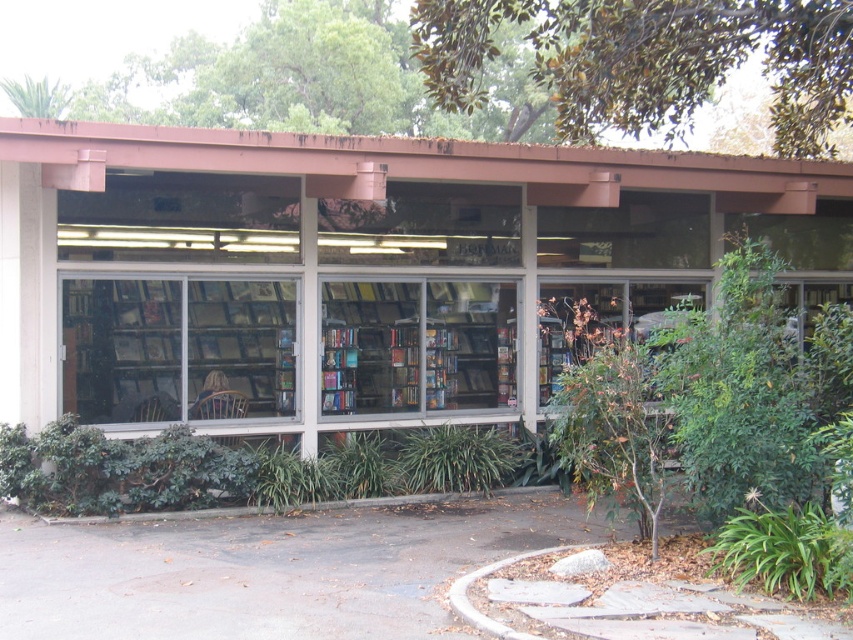
From the picture: Does clear glass windows at center have a greater height compared to wooden bookshelf at center?

Indeed, clear glass windows at center has a greater height compared to wooden bookshelf at center.

Does clear glass windows at center have a lesser height compared to wooden bookshelf at center?

No.

Is point (186, 392) farther from camera compared to point (445, 307)?

No, it is not.

Where is `clear glass windows at center`? clear glass windows at center is located at coordinates (357, 268).

Between point (234, 342) and point (614, 321), which one is positioned in front?

Point (234, 342) is more forward.

Where is `clear glass bookshelf at center`? clear glass bookshelf at center is located at coordinates (178, 348).

Based on the photo, can you confirm if clear glass windows at center is positioned to the right of clear glass bookshelf at center?

Correct, you'll find clear glass windows at center to the right of clear glass bookshelf at center.

Where is `clear glass windows at center`? The image size is (853, 640). clear glass windows at center is located at coordinates (357, 268).